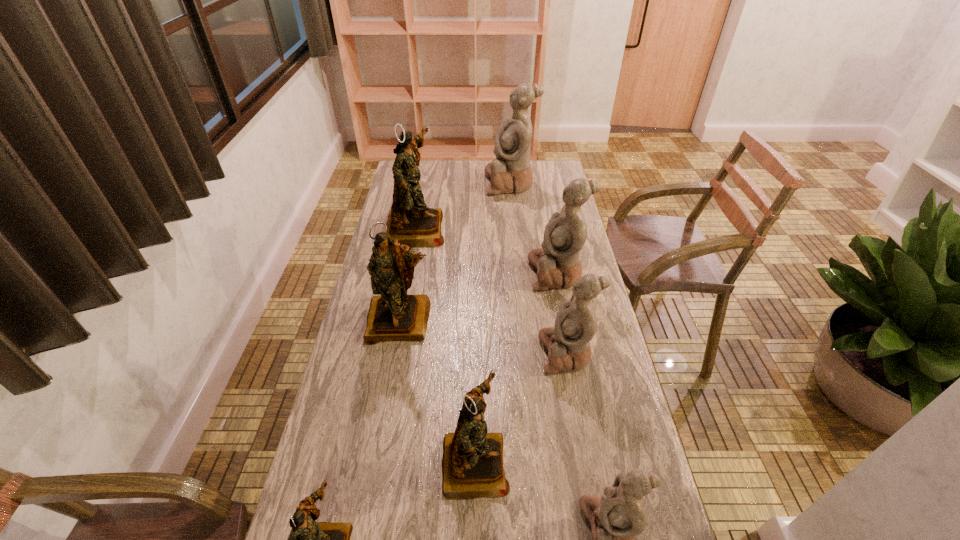
Find the location of a particular element. The width and height of the screenshot is (960, 540). the farthest white figurine is located at coordinates (511, 171).

I want to click on the biggest white figurine, so click(511, 171).

I want to click on the biggest gold figurine, so (x=410, y=221).

Where is `the farthest gold figurine`? The height and width of the screenshot is (540, 960). the farthest gold figurine is located at coordinates (410, 221).

At what (x,y) coordinates should I click in order to perform the action: click on the third farthest figurine. Please return your answer as a coordinate pair (x, y). Image resolution: width=960 pixels, height=540 pixels. Looking at the image, I should click on (558, 264).

At what (x,y) coordinates should I click in order to perform the action: click on the third farthest object. Please return your answer as a coordinate pair (x, y). Looking at the image, I should click on (558, 264).

Locate an element on the screen. the second farthest gold figurine is located at coordinates (393, 315).

Image resolution: width=960 pixels, height=540 pixels. I want to click on the third biggest gold figurine, so click(472, 463).

Find the location of a particular element. The width and height of the screenshot is (960, 540). the second nearest gold figurine is located at coordinates (472, 463).

Locate an element on the screen. This screenshot has height=540, width=960. the second smallest white figurine is located at coordinates (568, 343).